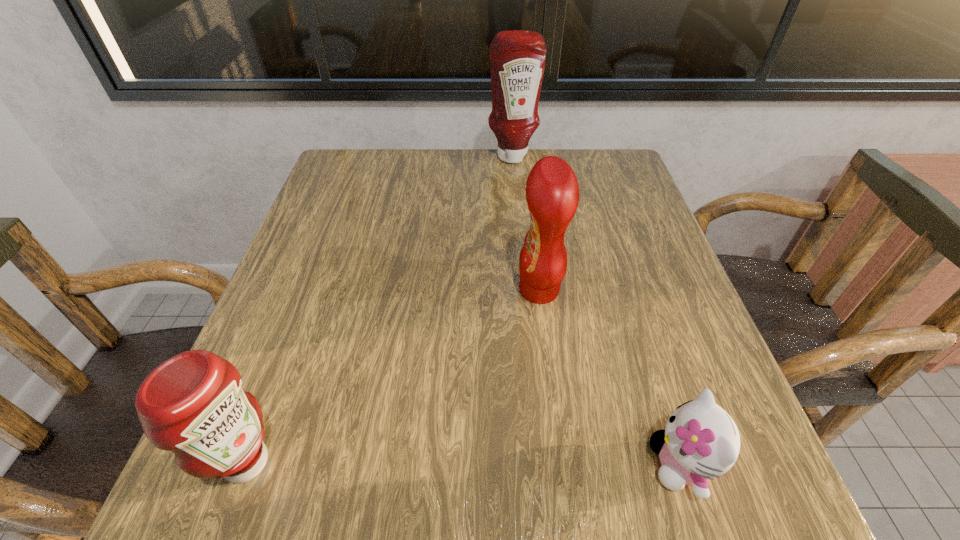
At what (x,y) coordinates should I click in order to perform the action: click on object at the right edge. Please return your answer as a coordinate pair (x, y). This screenshot has width=960, height=540. Looking at the image, I should click on (700, 440).

Identify the location of object that is positioned at the near left corner. The image size is (960, 540). (193, 404).

This screenshot has height=540, width=960. I want to click on object that is at the near right corner, so click(x=700, y=440).

This screenshot has height=540, width=960. I want to click on free space at the far edge of the desktop, so click(x=519, y=200).

Find the location of a particular element. free region at the left edge is located at coordinates (361, 253).

Identify the location of blank space at the right edge. The image size is (960, 540). (631, 237).

This screenshot has width=960, height=540. I want to click on vacant space at the far left corner, so click(396, 157).

Where is `free location at the near left corner of the desktop`? Image resolution: width=960 pixels, height=540 pixels. free location at the near left corner of the desktop is located at coordinates (243, 503).

Locate an element on the screen. This screenshot has height=540, width=960. vacant space at the far right corner of the desktop is located at coordinates pos(620,156).

Where is `vacant area that lies between the shortest object and the second tallest condiment`? The image size is (960, 540). vacant area that lies between the shortest object and the second tallest condiment is located at coordinates (610, 377).